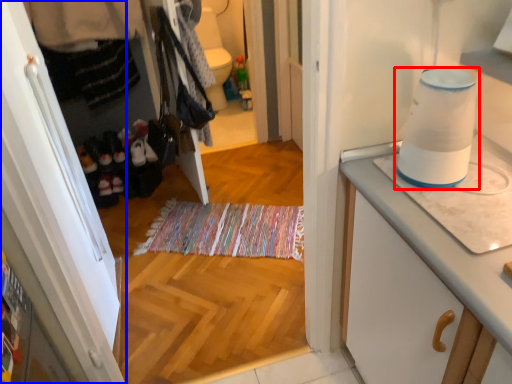
Question: Which point is further to the camera, home appliance (highlighted by a red box) or cabinetry (highlighted by a blue box)?

Choices:
 (A) home appliance
 (B) cabinetry

Answer: (B)